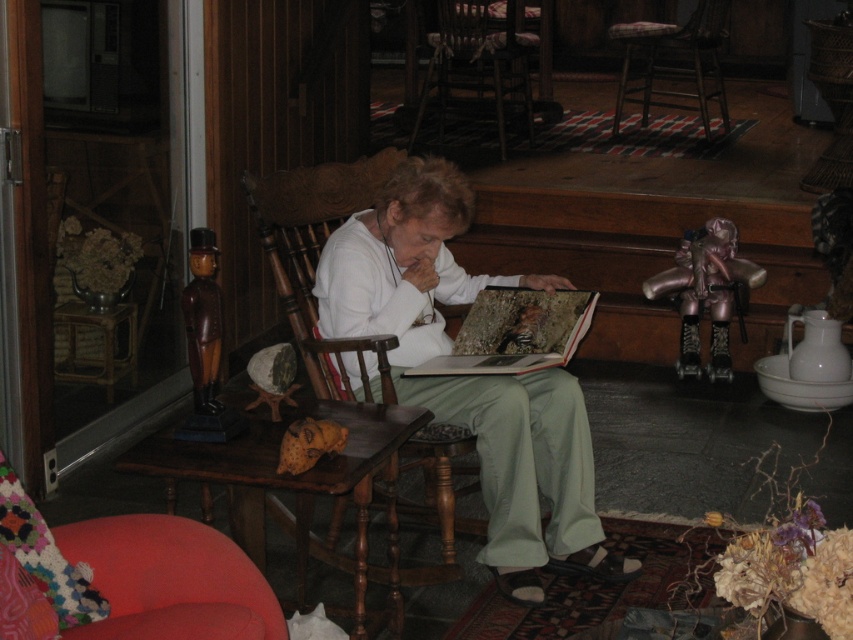
You are arranging items on a table and need to place the white matte sweater at center and the plaid fabric cushioned stool at center. According to their positions, which item is on the right side?

The plaid fabric cushioned stool at center is on the right side because the white matte sweater at center is to its left.